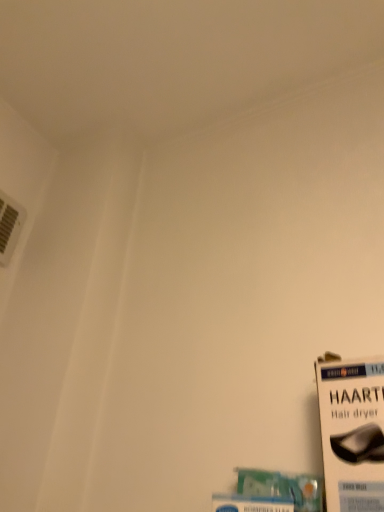
The image size is (384, 512). Describe the element at coordinates (9, 227) in the screenshot. I see `white plastic air conditioning at upper left` at that location.

Locate an element on the screen. white plastic air conditioning at upper left is located at coordinates (9, 227).

What is the approximate height of white plastic air conditioning at upper left?

white plastic air conditioning at upper left is 7.12 inches in height.

Identify the location of white plastic air conditioning at upper left. (9, 227).